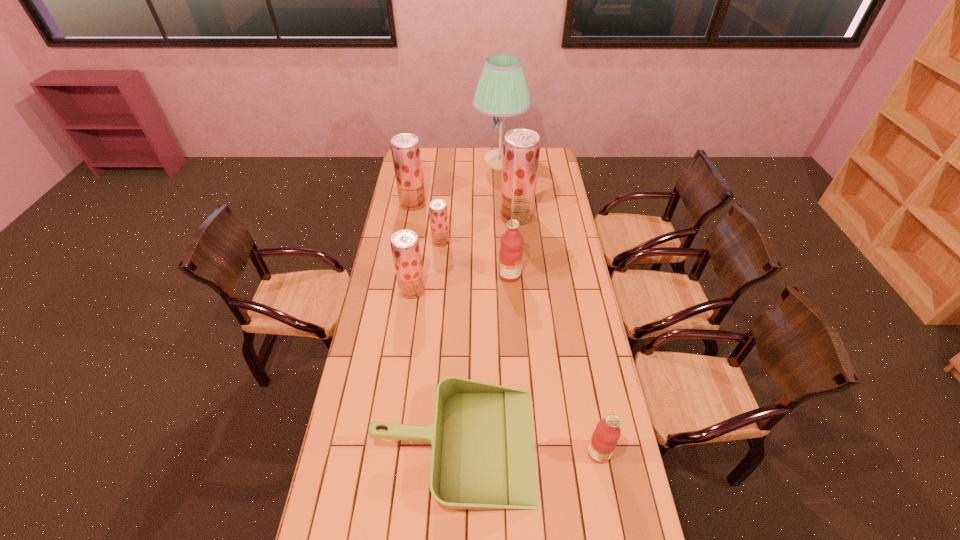
The image size is (960, 540). Find the location of `the fourth closest fruit juice relative to the shortest object`. the fourth closest fruit juice relative to the shortest object is located at coordinates (438, 212).

Find the location of a particular element. Image resolution: width=960 pixels, height=540 pixels. the third closest fruit juice relative to the tallest fruit juice is located at coordinates (405, 148).

Choose which strawberry fruit juice is the nearest neighbor to the rightmost strawberry fruit juice. Please provide its 2D coordinates. Your answer should be formatted as a tuple, i.e. [(x, y)], where the tuple contains the x and y coordinates of a point satisfying the conditions above.

[(438, 212)]

Identify which strawberry fruit juice is the third closest to the shortest object. Please provide its 2D coordinates. Your answer should be formatted as a tuple, i.e. [(x, y)], where the tuple contains the x and y coordinates of a point satisfying the conditions above.

[(521, 147)]